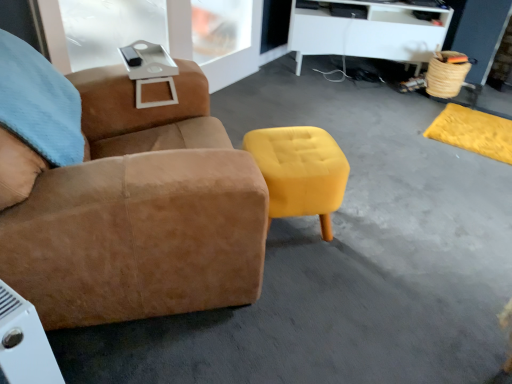
Question: Is the depth of yellow suede ottoman at center less than that of white matte desk at upper center?

Choices:
 (A) no
 (B) yes

Answer: (B)

Question: Is yellow suede ottoman at center completely or partially outside of white matte desk at upper center?

Choices:
 (A) no
 (B) yes

Answer: (B)

Question: From the image's perspective, is yellow suede ottoman at center under white matte desk at upper center?

Choices:
 (A) yes
 (B) no

Answer: (A)

Question: Are yellow suede ottoman at center and white matte desk at upper center making contact?

Choices:
 (A) no
 (B) yes

Answer: (A)

Question: From the image's perspective, is yellow suede ottoman at center over white matte desk at upper center?

Choices:
 (A) yes
 (B) no

Answer: (B)

Question: Is yellow suede ottoman at center taller or shorter than white matte desk at upper center?

Choices:
 (A) tall
 (B) short

Answer: (B)

Question: From a real-world perspective, is yellow suede ottoman at center positioned above or below white matte desk at upper center?

Choices:
 (A) above
 (B) below

Answer: (B)

Question: Based on their sizes in the image, would you say yellow suede ottoman at center is bigger or smaller than white matte desk at upper center?

Choices:
 (A) small
 (B) big

Answer: (A)

Question: Considering the positions of point (287, 198) and point (384, 29), is point (287, 198) closer or farther from the camera than point (384, 29)?

Choices:
 (A) farther
 (B) closer

Answer: (B)

Question: Is point (301, 23) positioned closer to the camera than point (134, 271)?

Choices:
 (A) closer
 (B) farther

Answer: (B)

Question: In the image, is white matte desk at upper center positioned in front of or behind suede brown chair at center?

Choices:
 (A) behind
 (B) front

Answer: (A)

Question: From the image's perspective, is white matte desk at upper center above or below suede brown chair at center?

Choices:
 (A) above
 (B) below

Answer: (A)

Question: Considering the positions of white matte desk at upper center and suede brown chair at center in the image, is white matte desk at upper center taller or shorter than suede brown chair at center?

Choices:
 (A) tall
 (B) short

Answer: (B)

Question: Is point (377, 26) positioned closer to the camera than point (313, 130)?

Choices:
 (A) farther
 (B) closer

Answer: (A)

Question: In terms of width, does white matte desk at upper center look wider or thinner when compared to yellow suede ottoman at center?

Choices:
 (A) wide
 (B) thin

Answer: (A)